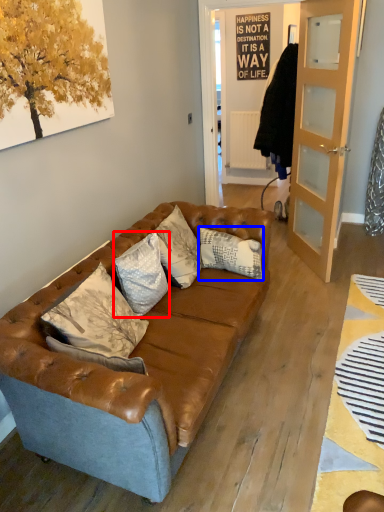
Question: Among these objects, which one is farthest to the camera, pillow (highlighted by a red box) or pillow (highlighted by a blue box)?

Choices:
 (A) pillow
 (B) pillow

Answer: (B)